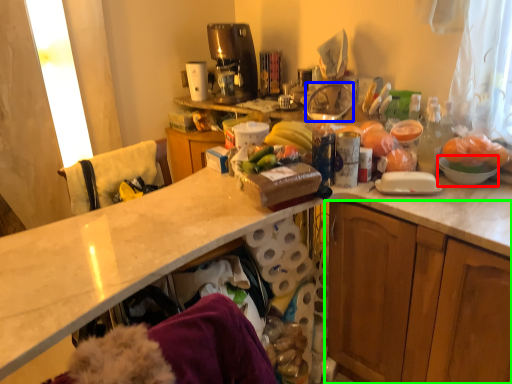
Question: Which object is positioned closest to mixing bowl (highlighted by a red box)? Select from appliance (highlighted by a blue box) and cabinetry (highlighted by a green box).

Choices:
 (A) appliance
 (B) cabinetry

Answer: (B)